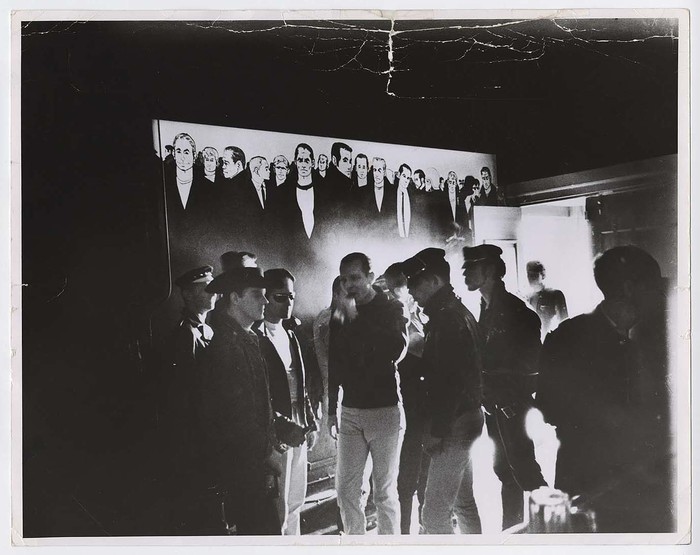
Find the location of a particular element. The height and width of the screenshot is (555, 700). wall is located at coordinates tap(638, 211).